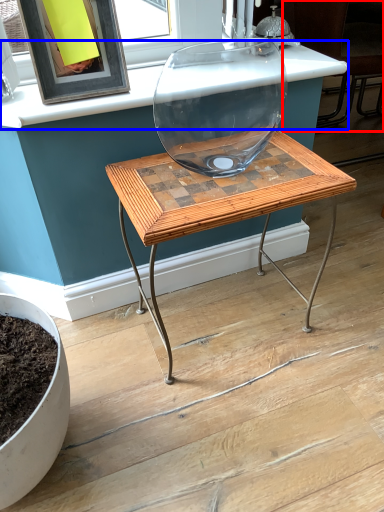
Question: Which point is further to the camera, chair (highlighted by a red box) or counter top (highlighted by a blue box)?

Choices:
 (A) chair
 (B) counter top

Answer: (A)